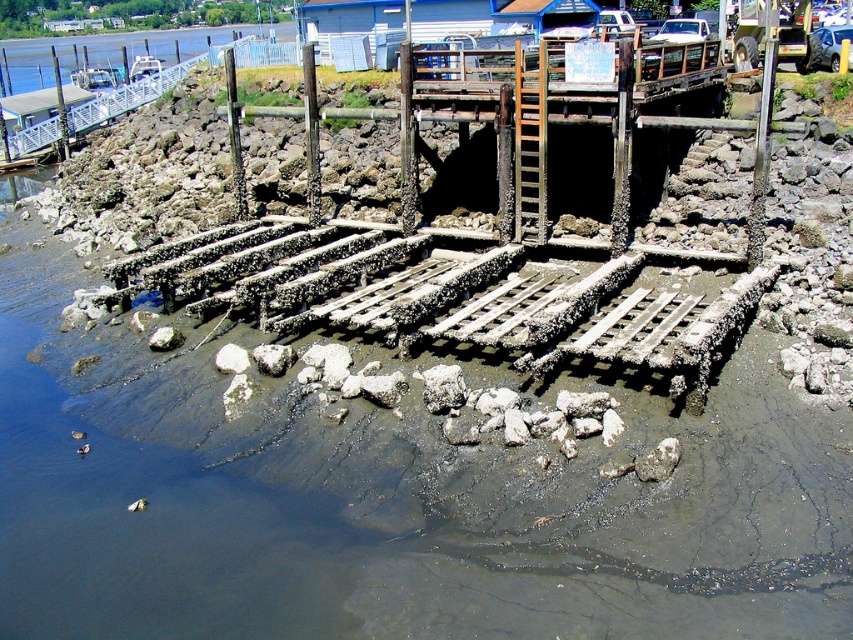
Question: Which point appears closest to the camera in this image?

Choices:
 (A) (651, 323)
 (B) (479, 93)

Answer: (A)

Question: Among these objects, which one is nearest to the camera?

Choices:
 (A) rusty metal dock at lower center
 (B) rusty wood dock at center

Answer: (A)

Question: Is rusty metal dock at lower center further to camera compared to rusty wood dock at center?

Choices:
 (A) no
 (B) yes

Answer: (A)

Question: Can you confirm if rusty metal dock at lower center is positioned to the right of rusty wood dock at center?

Choices:
 (A) yes
 (B) no

Answer: (B)

Question: Where is rusty metal dock at lower center located in relation to rusty wood dock at center in the image?

Choices:
 (A) below
 (B) above

Answer: (A)

Question: Which point appears closest to the camera in this image?

Choices:
 (A) (566, 118)
 (B) (511, 339)

Answer: (B)